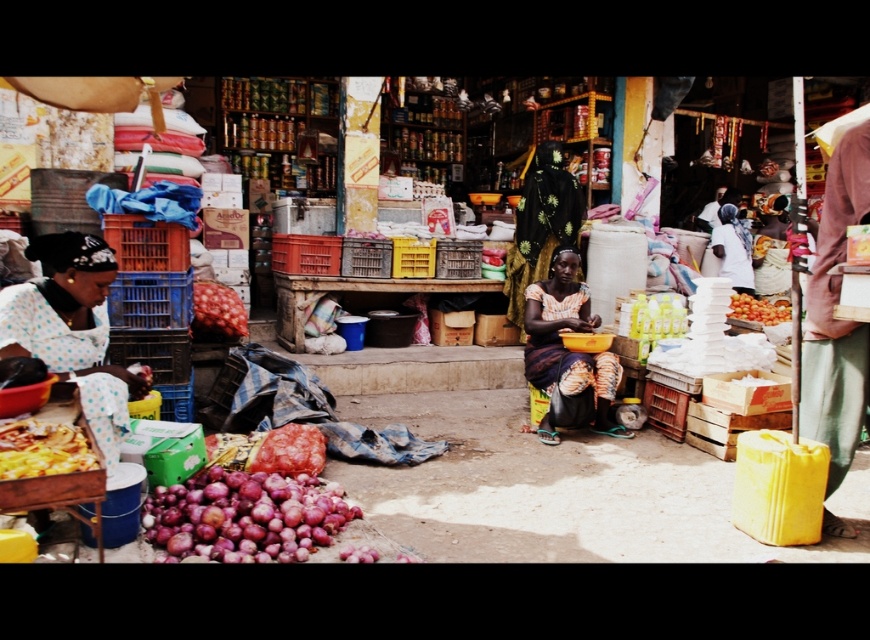
Question: In this image, where is golden crispy pizza at lower left located relative to smooth yellow tomatoes at center right?

Choices:
 (A) above
 (B) below

Answer: (B)

Question: Can you confirm if golden crispy pizza at lower left is thinner than smooth yellow tomatoes at center right?

Choices:
 (A) no
 (B) yes

Answer: (B)

Question: Considering the real-world distances, which object is closest to the polka dot fabric at left?

Choices:
 (A) smooth red onion at center
 (B) smooth yellow tomatoes at center right
 (C) orange printed fabric at center

Answer: (A)

Question: Which object is farther from the camera taking this photo?

Choices:
 (A) shiny purple onion at lower left
 (B) orange printed fabric at center
 (C) polka dot fabric at left

Answer: (B)

Question: Which point is closer to the camera?

Choices:
 (A) polka dot fabric at left
 (B) orange printed fabric at center

Answer: (A)

Question: Is golden crispy pizza at lower left thinner than smooth red onion at center?

Choices:
 (A) yes
 (B) no

Answer: (A)